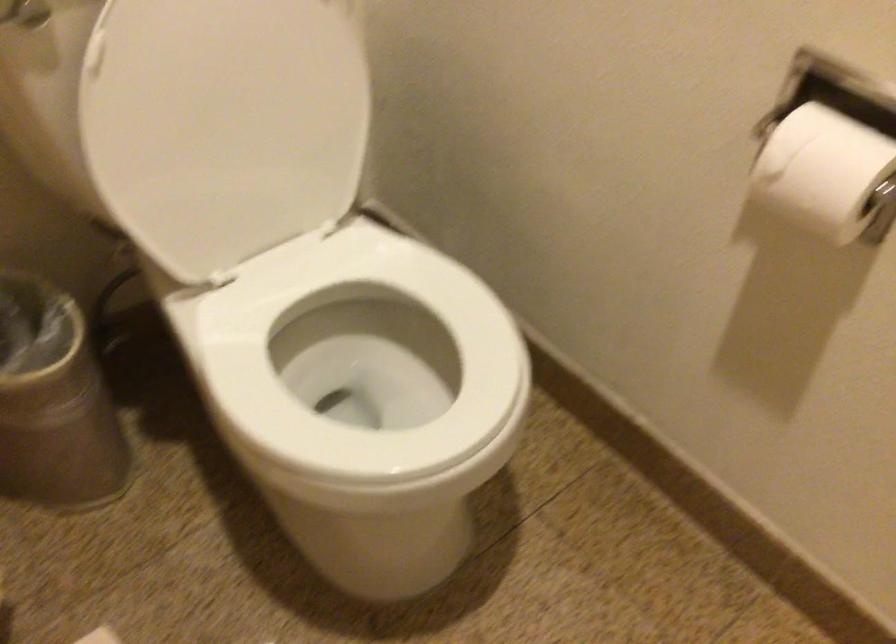
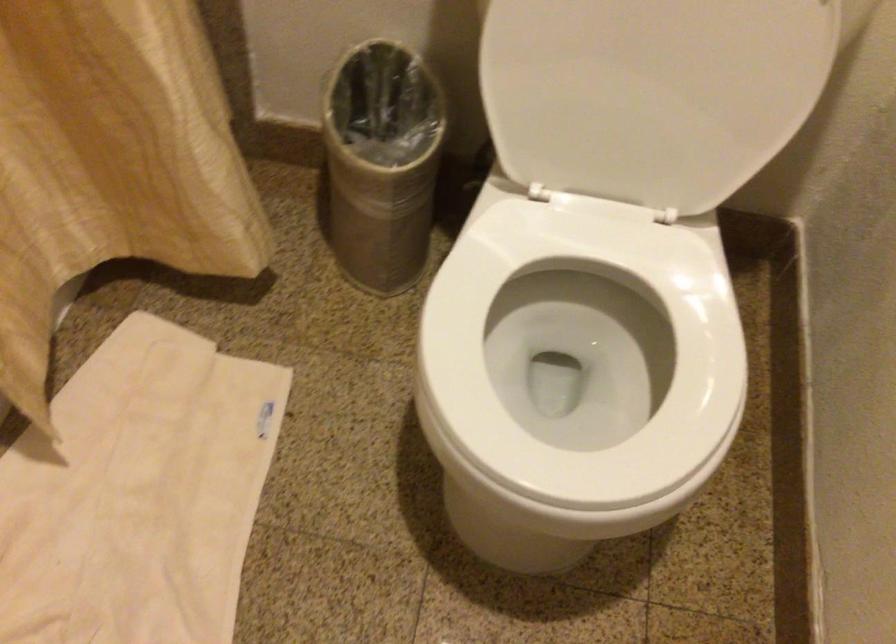
In the scene shown: How did the camera likely rotate?

The camera rotated toward left-down.